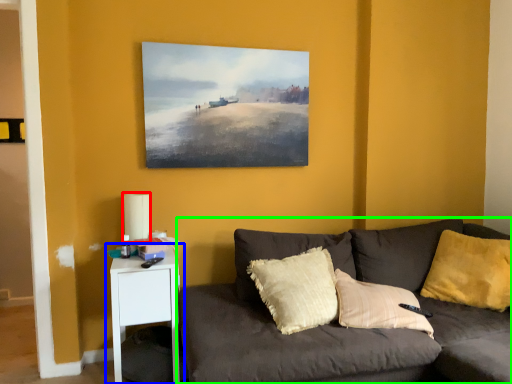
Question: Based on their relative distances, which object is nearer to lamp (highlighted by a red box)? Choose from nightstand (highlighted by a blue box) and studio couch (highlighted by a green box).

Choices:
 (A) nightstand
 (B) studio couch

Answer: (A)